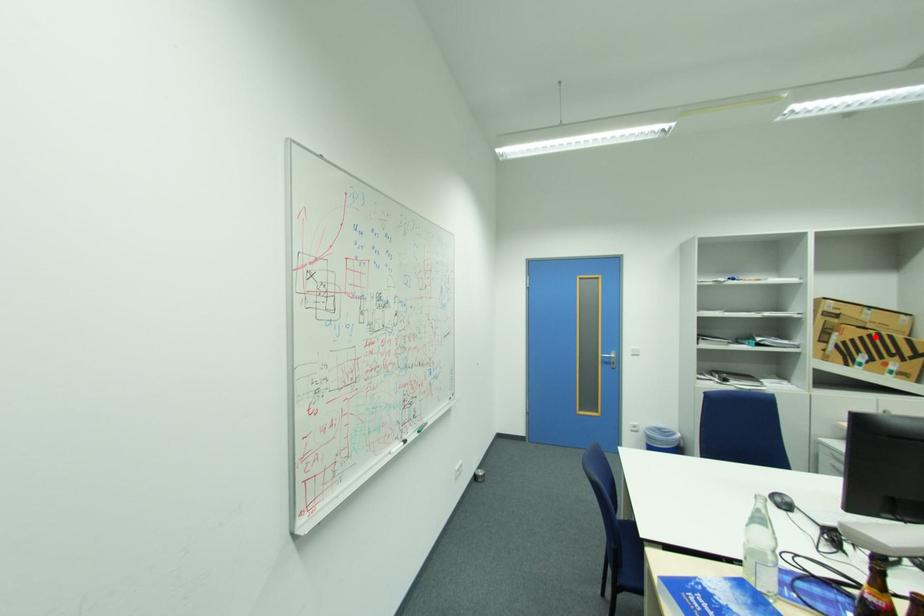
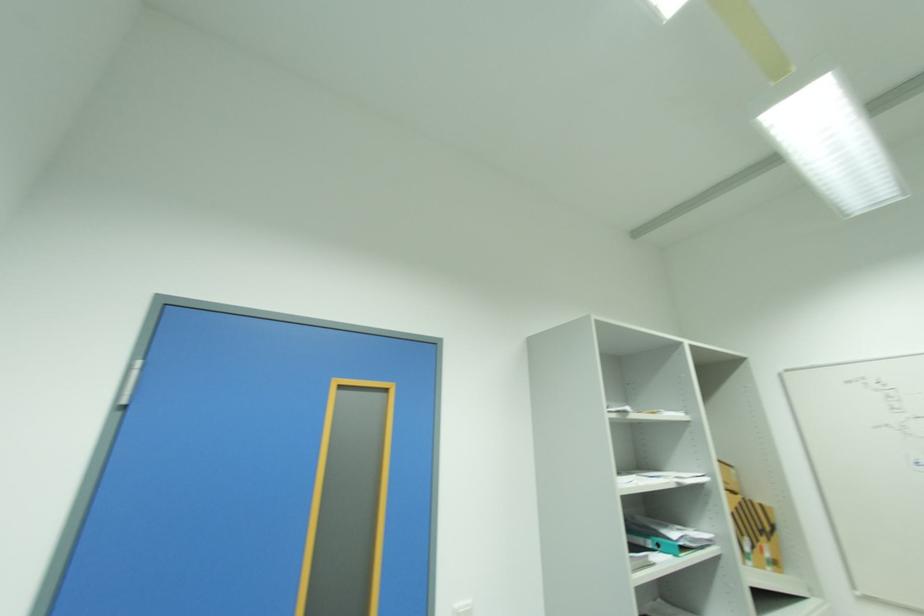
Question: I am providing you with two images of the same scene from different viewpoints. A red point is marked on the first image. At the location where the point appears in image 1, is it still visible in image 2?

Choices:
 (A) Yes
 (B) No

Answer: (A)